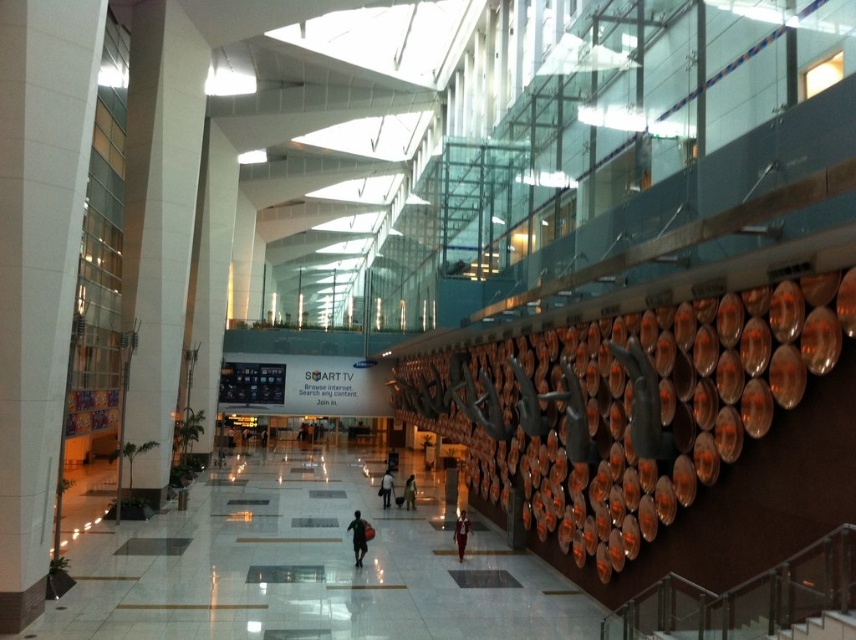
Question: Which point is closer to the camera?

Choices:
 (A) dark brown leather jacket at lower center
 (B) dark blue fabric at center

Answer: (B)

Question: Which object is positioned closest to the dark brown leather jacket at center?

Choices:
 (A) dark blue fabric at center
 (B) dark gray fabric bag at center

Answer: (B)

Question: Among these points, which one is farthest from the camera?

Choices:
 (A) (413, 508)
 (B) (461, 544)
 (C) (387, 496)
 (D) (361, 540)

Answer: (A)

Question: Does dark gray fabric bag at center come behind dark brown leather jacket at center?

Choices:
 (A) yes
 (B) no

Answer: (B)

Question: Can you confirm if dark blue fabric at center is positioned to the right of dark gray fabric bag at center?

Choices:
 (A) yes
 (B) no

Answer: (A)

Question: Is dark brown leather jacket at lower center smaller than dark gray fabric bag at center?

Choices:
 (A) no
 (B) yes

Answer: (B)